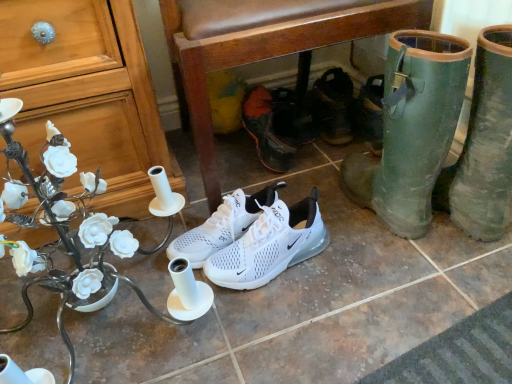
Locate an element on the screen. This screenshot has width=512, height=384. free space in front of black leather sandals at center, placed as the fifth footwear when sorted from front to back is located at coordinates (324, 153).